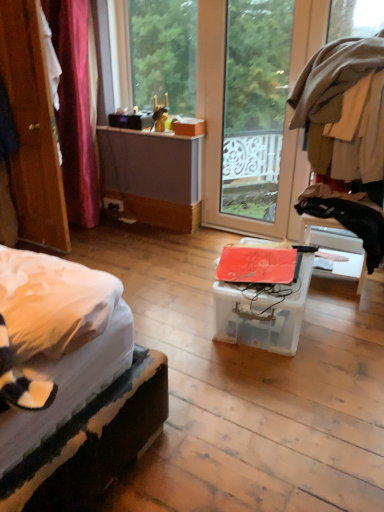
Identify the location of free space above black fabric at right (from a real-world perspective). The width and height of the screenshot is (384, 512). (342, 196).